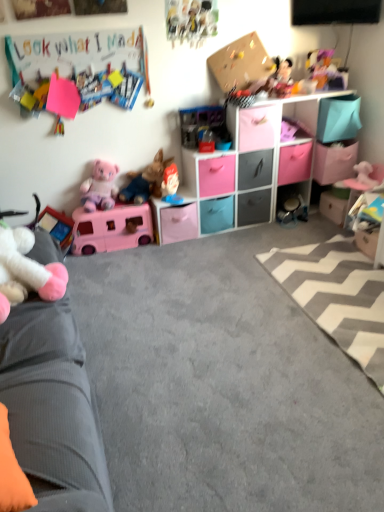
I want to click on vacant space to the left of gray/white zigzag rug at lower right, so click(x=225, y=353).